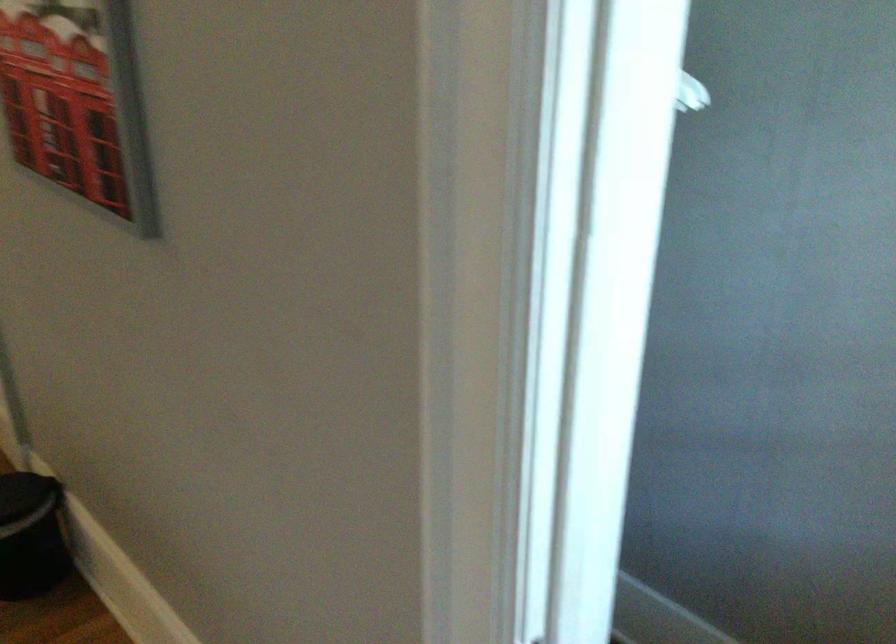
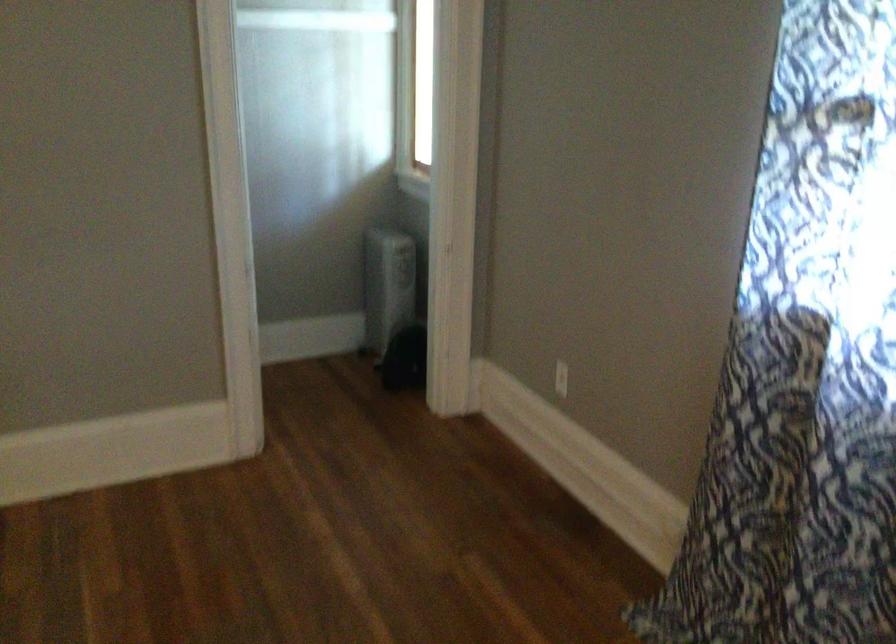
Question: I am providing you with two images of the same scene from different viewpoints. After the viewpoint changes to image2, which objects are now occluded?

Choices:
 (A) white closet rod
 (B) white clothes hanger
 (C) electrical outlet
 (D) bottom drawer handle

Answer: (B)